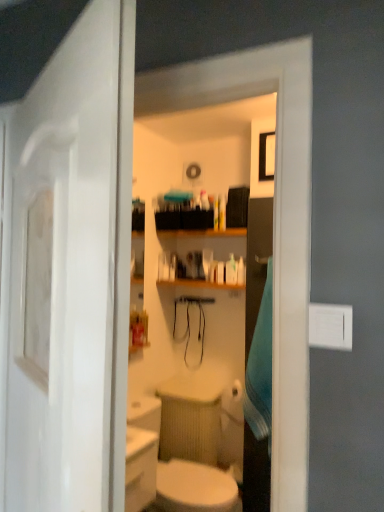
Question: Considering the relative sizes of white glossy sink at lower center and white glossy door at left in the image provided, is white glossy sink at lower center smaller than white glossy door at left?

Choices:
 (A) yes
 (B) no

Answer: (B)

Question: Is white glossy sink at lower center wider than white glossy door at left?

Choices:
 (A) yes
 (B) no

Answer: (A)

Question: Is white glossy sink at lower center not close to white glossy door at left?

Choices:
 (A) yes
 (B) no

Answer: (A)

Question: Is the position of white glossy sink at lower center less distant than that of white glossy door at left?

Choices:
 (A) no
 (B) yes

Answer: (A)

Question: Considering the relative sizes of white glossy sink at lower center and white glossy door at left in the image provided, is white glossy sink at lower center thinner than white glossy door at left?

Choices:
 (A) no
 (B) yes

Answer: (A)

Question: Is white glossy door at left inside or outside of blue fabric towel at right?

Choices:
 (A) outside
 (B) inside

Answer: (A)

Question: Is white glossy door at left to the left or to the right of blue fabric towel at right in the image?

Choices:
 (A) right
 (B) left

Answer: (B)

Question: Considering the positions of point (92, 295) and point (263, 360), is point (92, 295) closer or farther from the camera than point (263, 360)?

Choices:
 (A) farther
 (B) closer

Answer: (B)

Question: Considering the positions of white glossy door at left and blue fabric towel at right in the image, is white glossy door at left taller or shorter than blue fabric towel at right?

Choices:
 (A) tall
 (B) short

Answer: (A)

Question: Does point (253, 366) appear closer or farther from the camera than point (112, 184)?

Choices:
 (A) closer
 (B) farther

Answer: (B)

Question: Is blue fabric towel at right taller or shorter than white glossy door at left?

Choices:
 (A) short
 (B) tall

Answer: (A)

Question: Choose the correct answer: Is blue fabric towel at right inside white glossy door at left or outside it?

Choices:
 (A) inside
 (B) outside

Answer: (B)

Question: In the image, is blue fabric towel at right positioned in front of or behind white glossy door at left?

Choices:
 (A) behind
 (B) front

Answer: (A)

Question: Considering the positions of point (249, 398) and point (147, 430), is point (249, 398) closer or farther from the camera than point (147, 430)?

Choices:
 (A) farther
 (B) closer

Answer: (A)

Question: Considering the relative positions of blue fabric towel at right and white glossy sink at lower center in the image provided, is blue fabric towel at right to the left or to the right of white glossy sink at lower center?

Choices:
 (A) right
 (B) left

Answer: (A)